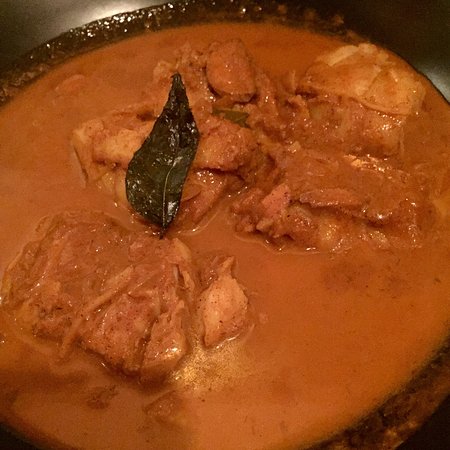
The width and height of the screenshot is (450, 450). What are the coordinates of `lower left rim of bowl` in the screenshot? It's located at (7, 437).